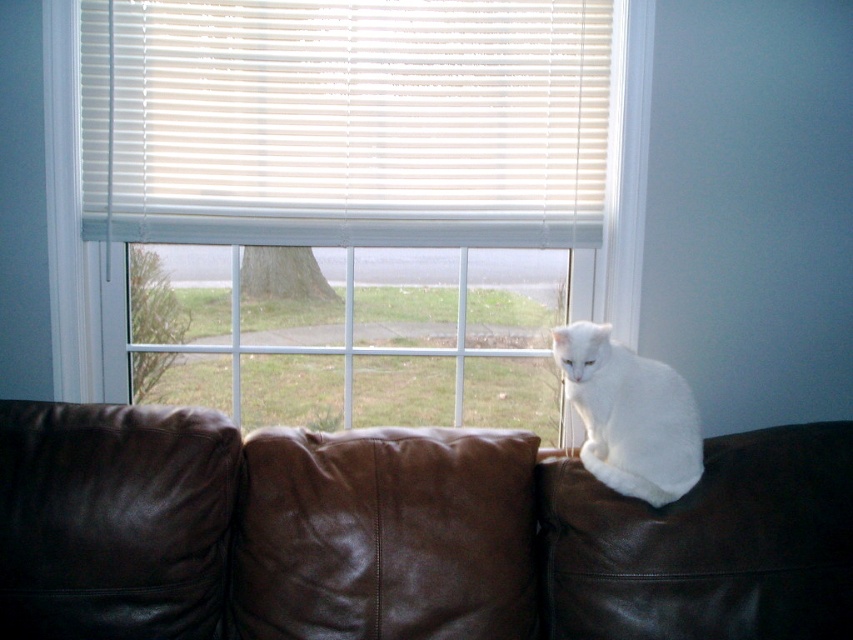
Is point (546, 552) farther from camera compared to point (350, 552)?

Yes, it is.

Does brown leather couch at upper center lie behind leather cushion at center?

That is False.

Is point (677, 502) farther from camera compared to point (512, 454)?

No, (677, 502) is closer to viewer.

Identify the location of brown leather couch at upper center. The image size is (853, 640). (405, 534).

Can you confirm if white plastic blinds at upper center is positioned below white fluffy cat at upper right?

Incorrect, white plastic blinds at upper center is not positioned below white fluffy cat at upper right.

Is white plastic blinds at upper center above white fluffy cat at upper right?

Yes, white plastic blinds at upper center is above white fluffy cat at upper right.

Does point (322, 148) lie in front of point (604, 378)?

That is False.

Locate an element on the screen. The image size is (853, 640). white plastic blinds at upper center is located at coordinates (345, 122).

Does brown leather couch at upper center have a lesser height compared to white fluffy cat at upper right?

Incorrect, brown leather couch at upper center's height does not fall short of white fluffy cat at upper right's.

Is brown leather couch at upper center to the left of white fluffy cat at upper right from the viewer's perspective?

Correct, you'll find brown leather couch at upper center to the left of white fluffy cat at upper right.

Locate an element on the screen. Image resolution: width=853 pixels, height=640 pixels. brown leather couch at upper center is located at coordinates (405, 534).